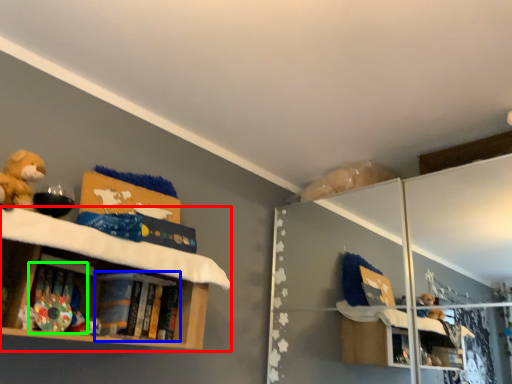
Question: Estimate the real-world distances between objects in this image. Which object is closer to shelf (highlighted by a red box), book (highlighted by a blue box) or book (highlighted by a green box)?

Choices:
 (A) book
 (B) book

Answer: (A)